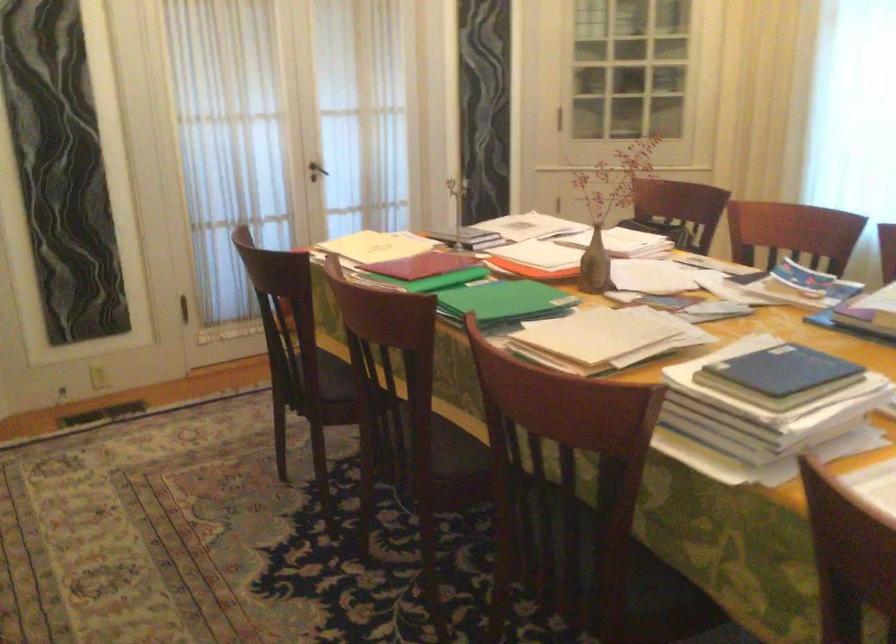
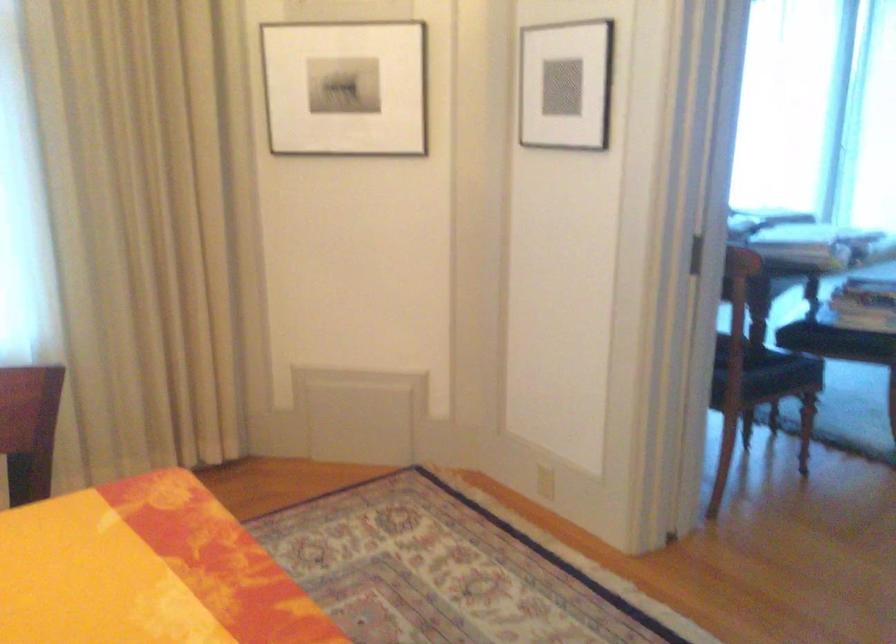
Question: The images are taken continuously from a first-person perspective. In which direction is your viewpoint rotating?

Choices:
 (A) Left
 (B) Right
 (C) Up
 (D) Down

Answer: (B)